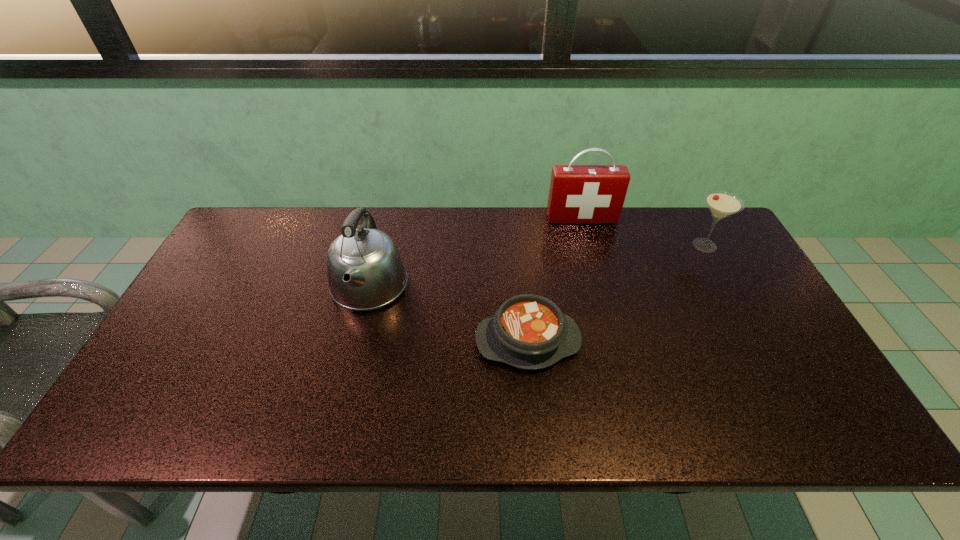
Identify the location of vacant position in the image that satisfies the following two spatial constraints: 1. on the front face of the first-aid kit; 2. on the left side of the second shortest object. (588, 245).

This screenshot has height=540, width=960. Identify the location of vacant space that satisfies the following two spatial constraints: 1. on the spout of the shortest object; 2. on the left side of the kettle. (355, 341).